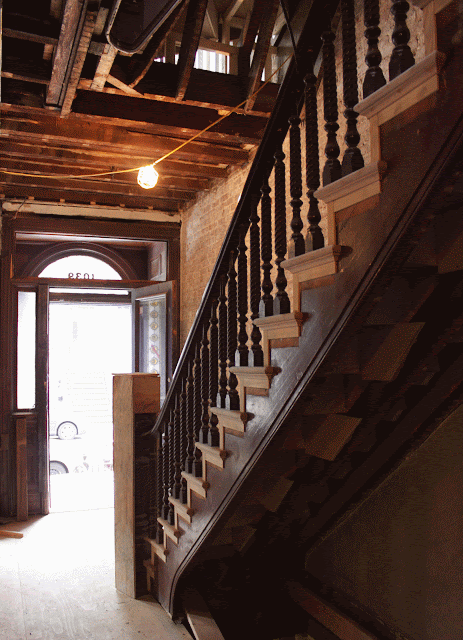
Image resolution: width=463 pixels, height=640 pixels. I want to click on light, so click(x=149, y=178).